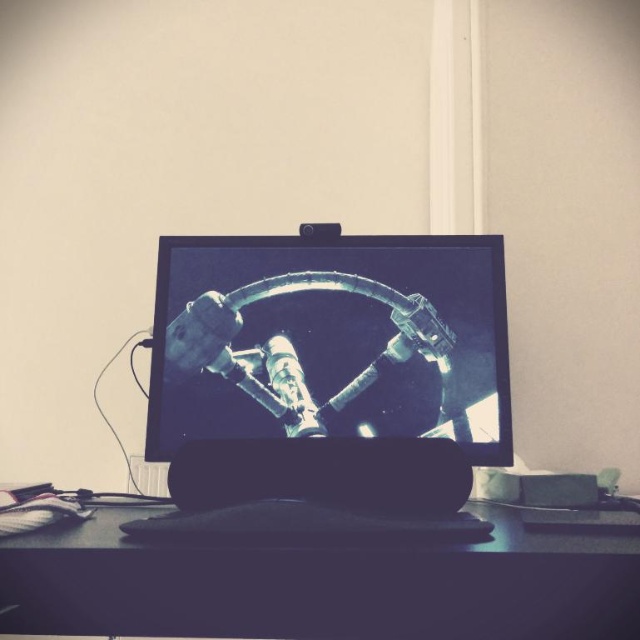
Can you confirm if matte black monitor at center is thinner than black matte computer desk at center?

Yes.

Does matte black monitor at center appear on the right side of black matte computer desk at center?

No, matte black monitor at center is not to the right of black matte computer desk at center.

Measure the distance between point (x=432, y=404) and camera.

Point (x=432, y=404) and camera are 3.93 feet apart from each other.

This screenshot has width=640, height=640. Identify the location of matte black monitor at center. (330, 339).